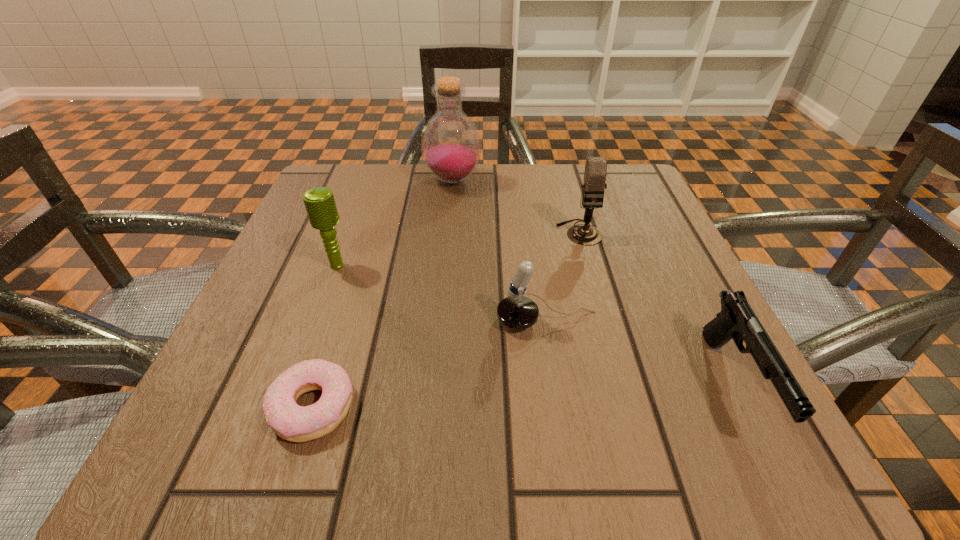
Identify the location of free space at the far right corner of the desktop. This screenshot has height=540, width=960. (649, 191).

In the image, there is a desktop. Identify the location of vacant space at the near right corner. Image resolution: width=960 pixels, height=540 pixels. (771, 433).

Where is `free space between the shortest microphone and the fourth object from right to left`? The image size is (960, 540). free space between the shortest microphone and the fourth object from right to left is located at coordinates (500, 251).

Find the location of a particular element. The height and width of the screenshot is (540, 960). free area in between the rightmost object and the nearest microphone is located at coordinates (640, 353).

Image resolution: width=960 pixels, height=540 pixels. Find the location of `vacant region between the second farthest microphone and the rightmost object`. vacant region between the second farthest microphone and the rightmost object is located at coordinates (536, 325).

Locate an element on the screen. The image size is (960, 540). free space between the fourth nearest object and the shortest microphone is located at coordinates (443, 293).

The image size is (960, 540). I want to click on vacant space in between the farthest object and the shortest object, so click(x=383, y=294).

I want to click on free space between the fifth nearest object and the gun, so click(657, 308).

In order to click on vacant space in between the nearest microphone and the doughnut in this screenshot , I will do `click(430, 364)`.

At what (x,y) coordinates should I click in order to perform the action: click on vacant space that's between the gun and the fourth object from right to left. Please return your answer as a coordinate pair (x, y). The width and height of the screenshot is (960, 540). Looking at the image, I should click on (593, 282).